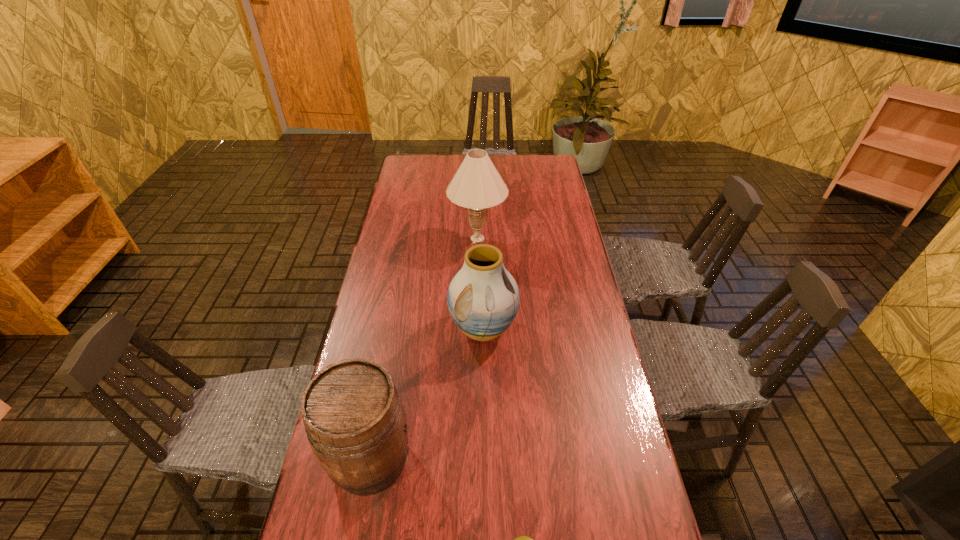
In the image, there is a desktop. At what (x,y) coordinates should I click in order to perform the action: click on vacant space at the left edge. Please return your answer as a coordinate pair (x, y). Looking at the image, I should click on (409, 235).

The image size is (960, 540). Find the location of `vacant region at the right edge of the desktop`. vacant region at the right edge of the desktop is located at coordinates (588, 326).

In order to click on free point at the far left corner in this screenshot , I will do `click(433, 161)`.

The height and width of the screenshot is (540, 960). I want to click on vacant space that's between the second farthest object and the leftmost object, so click(x=427, y=394).

The image size is (960, 540). I want to click on empty location between the vase and the cider, so click(x=427, y=394).

The width and height of the screenshot is (960, 540). I want to click on free space between the farthest object and the cider, so click(424, 349).

The width and height of the screenshot is (960, 540). What are the coordinates of `object that stands as the second closest to the shortest object` in the screenshot? It's located at (483, 298).

Find the location of a particular element. object that is the closest to the straw for drinking is located at coordinates (355, 422).